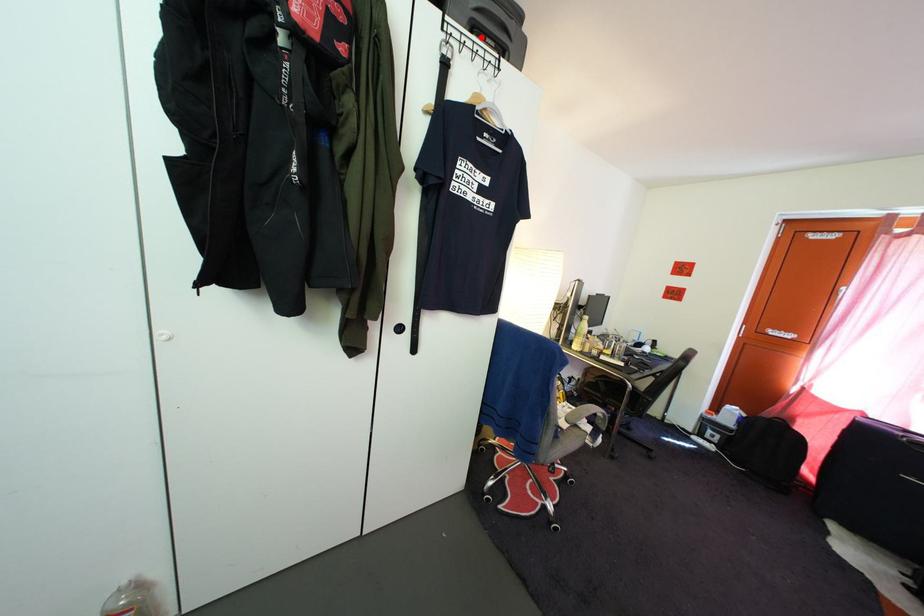
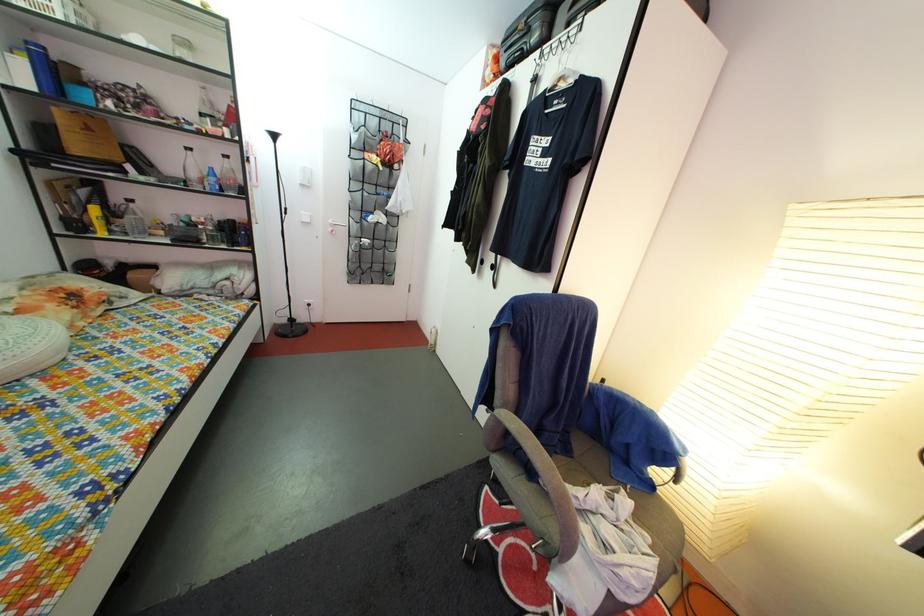
In the second image, find the point that corresponds to the highlighted location in the first image.

(578, 31)